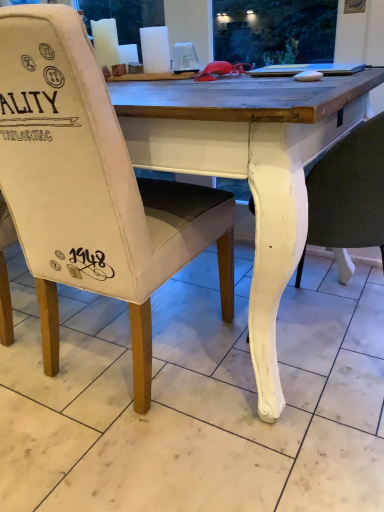
Question: From the image's perspective, is white painted wood chair at lower right, which appears as the first chair when viewed from the right, located beneath canvas chair at center, acting as the first chair starting from the left?

Choices:
 (A) no
 (B) yes

Answer: (B)

Question: Is white painted wood chair at lower right, placed as the second chair when sorted from left to right, far away from canvas chair at center, placed as the second chair when sorted from right to left?

Choices:
 (A) yes
 (B) no

Answer: (B)

Question: Is white painted wood chair at lower right, which appears as the first chair when viewed from the right, shorter than canvas chair at center, placed as the second chair when sorted from right to left?

Choices:
 (A) yes
 (B) no

Answer: (A)

Question: Is white painted wood chair at lower right, placed as the second chair when sorted from left to right, taller than canvas chair at center, acting as the first chair starting from the left?

Choices:
 (A) yes
 (B) no

Answer: (B)

Question: Is white painted wood chair at lower right, which appears as the first chair when viewed from the right, facing towards canvas chair at center, placed as the second chair when sorted from right to left?

Choices:
 (A) yes
 (B) no

Answer: (B)

Question: Is white marble tile at lower center wider or thinner than canvas chair at center, acting as the first chair starting from the left?

Choices:
 (A) wide
 (B) thin

Answer: (A)

Question: Is white marble tile at lower center spatially inside canvas chair at center, placed as the second chair when sorted from right to left, or outside of it?

Choices:
 (A) inside
 (B) outside

Answer: (B)

Question: Based on their positions, is white marble tile at lower center located to the left or right of canvas chair at center, placed as the second chair when sorted from right to left?

Choices:
 (A) left
 (B) right

Answer: (B)

Question: Is point (375, 369) closer or farther from the camera than point (109, 291)?

Choices:
 (A) closer
 (B) farther

Answer: (B)

Question: In terms of size, does white painted wood chair at lower right, which appears as the first chair when viewed from the right, appear bigger or smaller than white marble tile at lower center?

Choices:
 (A) small
 (B) big

Answer: (B)

Question: Looking at their shapes, would you say white painted wood chair at lower right, which appears as the first chair when viewed from the right, is wider or thinner than white marble tile at lower center?

Choices:
 (A) wide
 (B) thin

Answer: (B)

Question: From the image's perspective, relative to white marble tile at lower center, is white painted wood chair at lower right, placed as the second chair when sorted from left to right, above or below?

Choices:
 (A) above
 (B) below

Answer: (A)

Question: In the image, is white painted wood chair at lower right, placed as the second chair when sorted from left to right, on the left side or the right side of white marble tile at lower center?

Choices:
 (A) left
 (B) right

Answer: (B)

Question: Based on their positions, is canvas chair at center, acting as the first chair starting from the left, located to the left or right of white painted wood chair at lower right, which appears as the first chair when viewed from the right?

Choices:
 (A) left
 (B) right

Answer: (A)

Question: Does point (152, 261) appear closer or farther from the camera than point (329, 196)?

Choices:
 (A) closer
 (B) farther

Answer: (B)